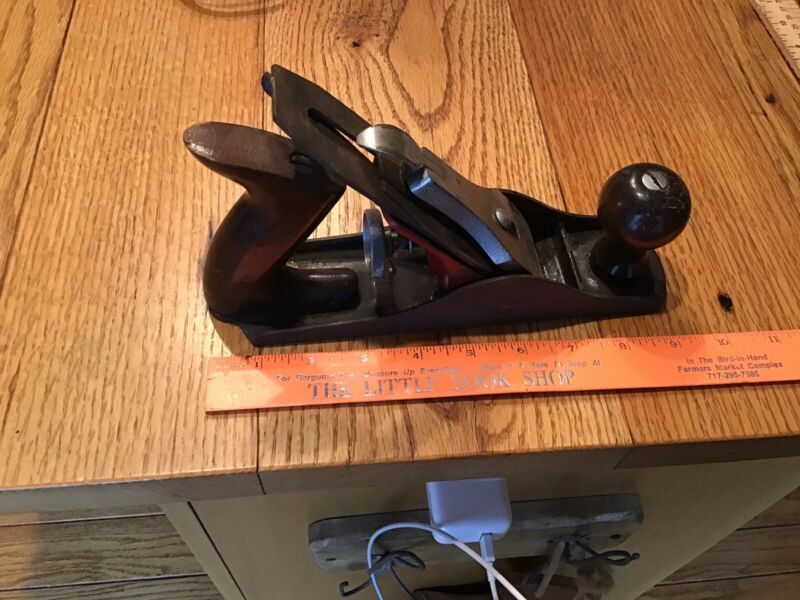
Identify the location of phone cord. (492, 571).